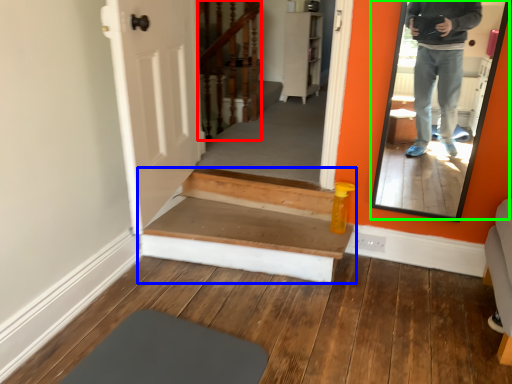
Question: Estimate the real-world distances between objects in this image. Which object is farther from stairwell (highlighted by a red box), stairs (highlighted by a blue box) or mirror (highlighted by a green box)?

Choices:
 (A) stairs
 (B) mirror

Answer: (B)